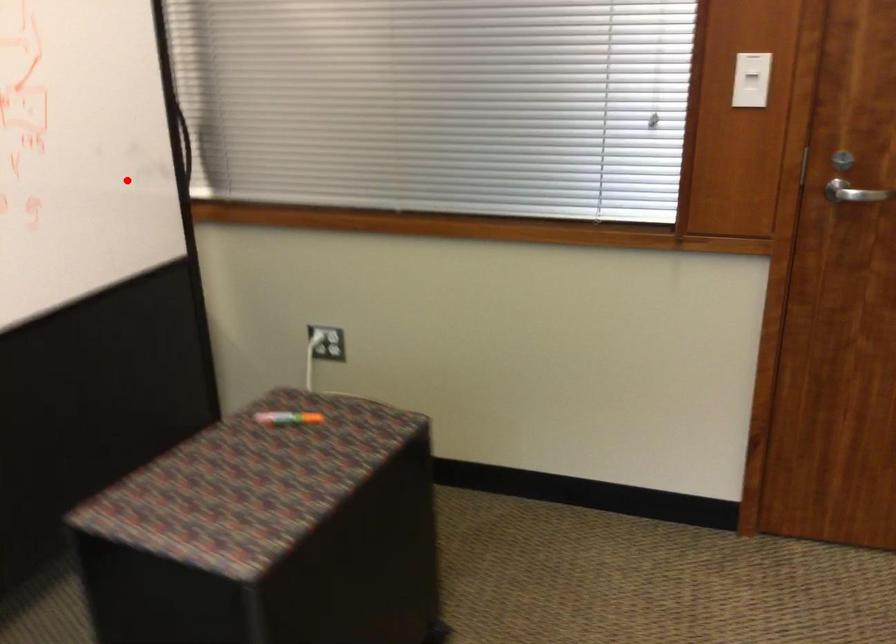
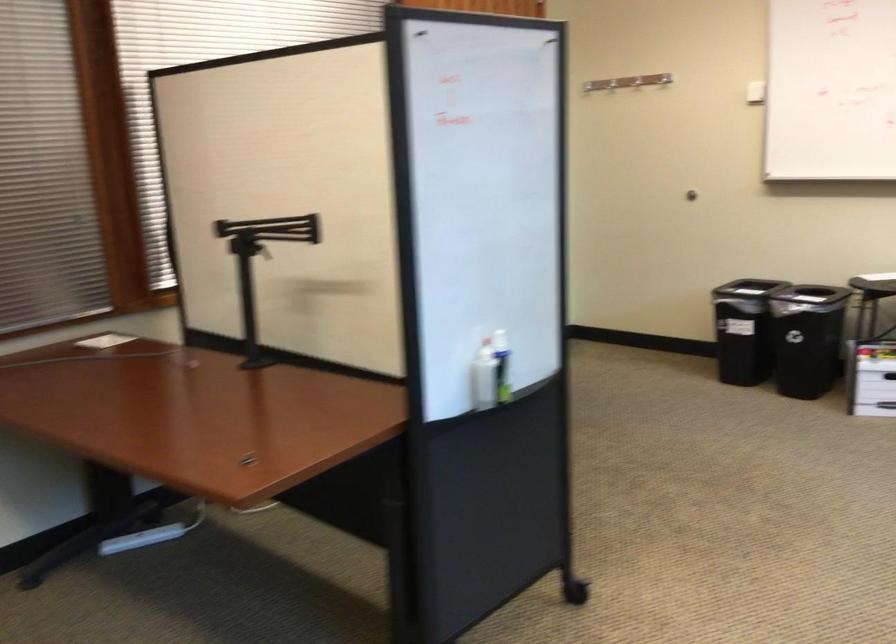
The point at the highlighted location is marked in the first image. Where is the corresponding point in the second image?

(261, 263)